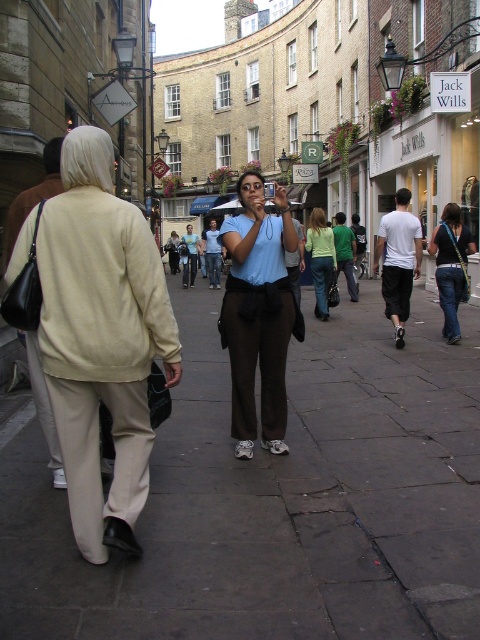
Consider the image. You are standing in the middle of the street and want to determine which of the two points, point (244, 305) or point (442, 266), is closer to you. Based on the scene description, which point is nearer?

Point (244, 305) is closer to the viewer than point (442, 266).

You are a photographer standing in the street scene. You need to capture a photo that includes both the matte blue shirt at center and denim jeans at center. Which object should you position on the left side of your frame to ensure both are in the shot?

You should position the matte blue shirt at center on the left side of your frame because it is already to the left of the denim jeans at center, ensuring both are included in the photo.

Based on the photo, you are standing in the middle of the street in the European city scene. There is a point marked at coordinates (x=261, y=544). Can you reach this point without moving more than 10 feet from your current position?

The point at (x=261, y=544) is 11.51 feet away from the viewer, which is beyond the 10 feet limit. Therefore, you cannot reach it without moving more than 10 feet.